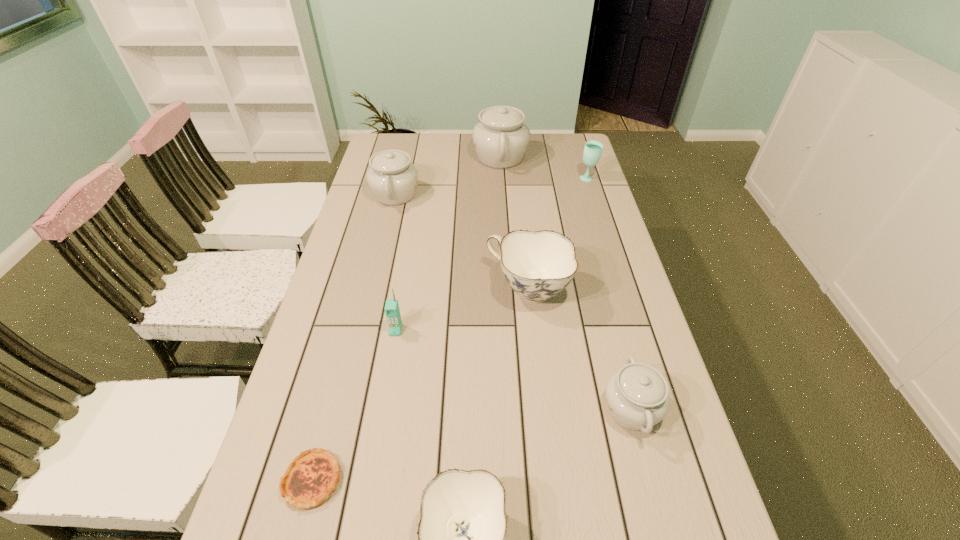
Find the location of a particular element. quiche is located at coordinates (311, 477).

Find the location of a particular element. blank space located on the left of the second white chinaware from right to left is located at coordinates (402, 158).

Where is `free location located 0.120m on the right of the leftmost chinaware`? This screenshot has height=540, width=960. free location located 0.120m on the right of the leftmost chinaware is located at coordinates (453, 194).

The image size is (960, 540). In order to click on vacant space located on the left of the third nearest chinaware in this screenshot , I will do `click(435, 289)`.

Find the location of `vacant space positioned 0.200m on the left of the glass`. vacant space positioned 0.200m on the left of the glass is located at coordinates (527, 179).

The image size is (960, 540). In order to click on vacant space located on the keypad of the cellular telephone in this screenshot , I will do `click(369, 491)`.

Locate an element on the screen. free space located on the left of the second nearest chinaware is located at coordinates (458, 409).

Locate an element on the screen. free space located 0.080m on the right of the quiche is located at coordinates (380, 480).

Identify the location of object situated at the far edge. (501, 138).

Locate an element on the screen. The image size is (960, 540). chinaware that is at the left edge is located at coordinates (392, 178).